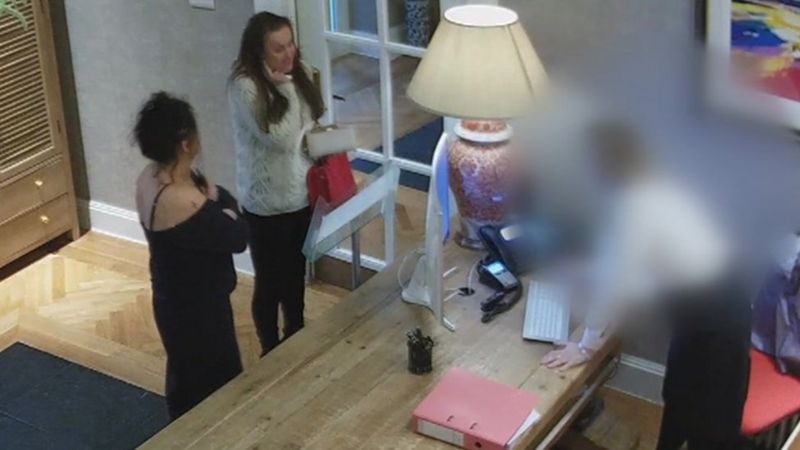
The image size is (800, 450). I want to click on phone, so click(x=490, y=239).